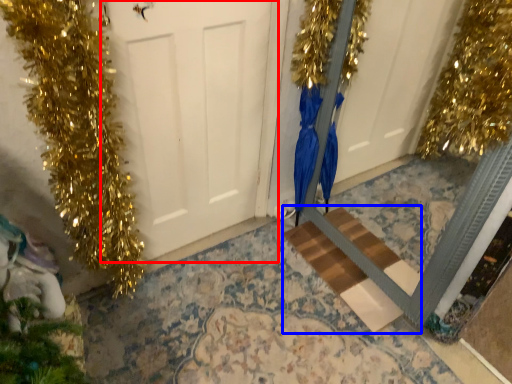
Question: Which object is closer to the camera taking this photo, door (highlighted by a red box) or stairwell (highlighted by a blue box)?

Choices:
 (A) door
 (B) stairwell

Answer: (A)